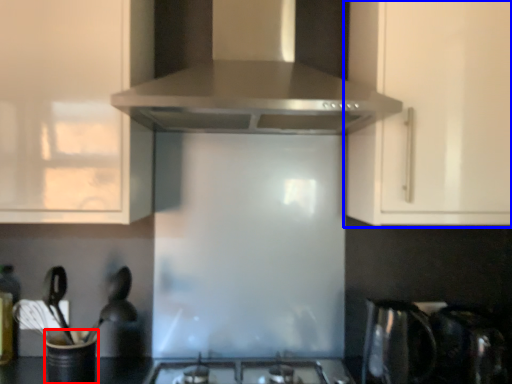
Question: Among these objects, which one is farthest to the camera, appliance (highlighted by a red box) or cabinetry (highlighted by a blue box)?

Choices:
 (A) appliance
 (B) cabinetry

Answer: (B)